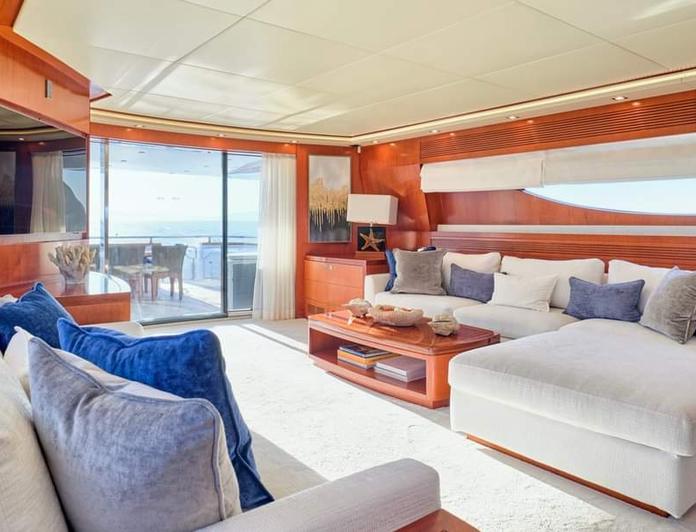
Where is `book`? The width and height of the screenshot is (696, 532). book is located at coordinates (351, 348), (388, 361).